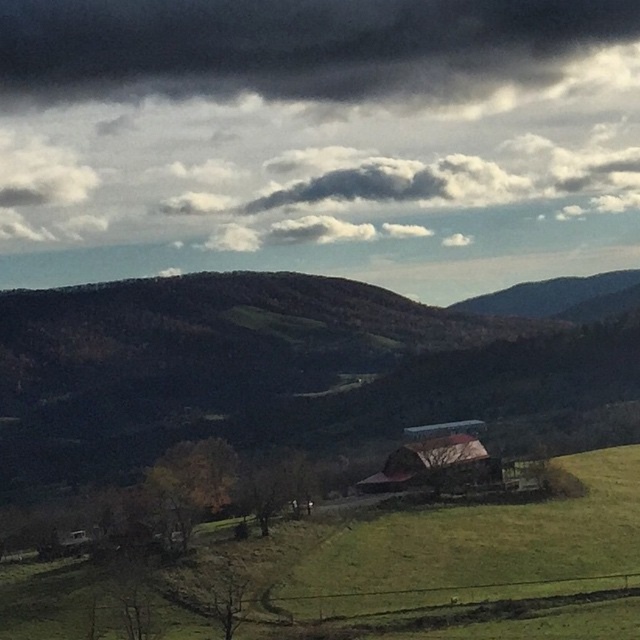
Between point (403, 10) and point (547, 545), which one is positioned in front?

Positioned in front is point (547, 545).

Is point (576, 33) farther from camera compared to point (58, 628)?

Yes, it is.

The width and height of the screenshot is (640, 640). Identify the location of dark gray cloud at upper center. (298, 48).